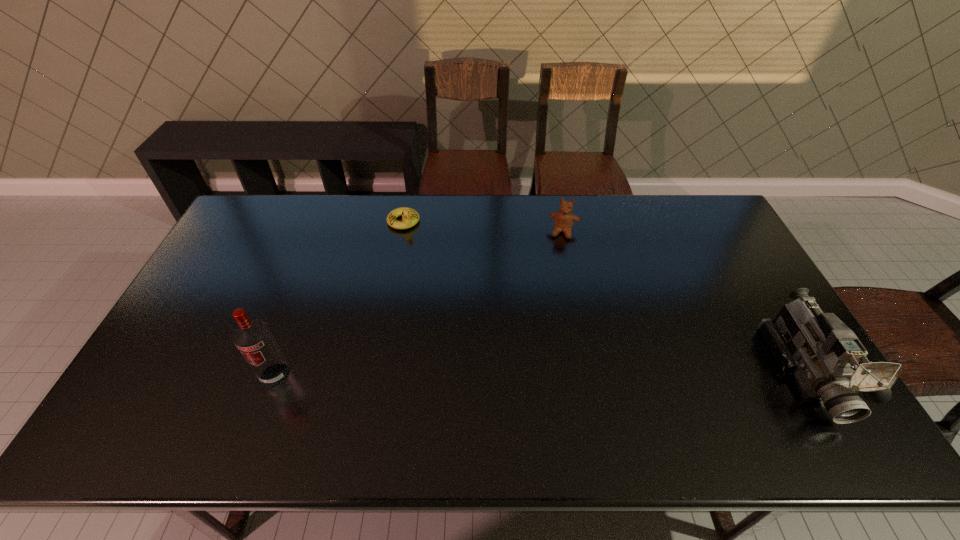
In order to click on vacant space located 0.220m on the face of the second object from left to right in this screenshot , I will do `click(431, 272)`.

This screenshot has height=540, width=960. I want to click on free spot located on the face of the second object from left to right, so click(437, 282).

Identify the location of free point located 0.250m on the face of the second shortest object. The width and height of the screenshot is (960, 540). (553, 293).

At what (x,y) coordinates should I click in order to perform the action: click on vacant space located on the face of the second shortest object. Please return your answer as a coordinate pair (x, y). This screenshot has width=960, height=540. Looking at the image, I should click on (546, 332).

You are a GUI agent. You are given a task and a screenshot of the screen. Output one action in this format:
    pyautogui.click(x=<x>, y=<y>)
    Task: Click on the vacant space located on the face of the second shortest object
    
    Given the screenshot: What is the action you would take?
    pyautogui.click(x=547, y=329)

The height and width of the screenshot is (540, 960). Identify the location of duckling that is at the far edge. (410, 217).

Identify the location of teddy bear present at the far edge. This screenshot has height=540, width=960. (564, 219).

In order to click on vodka located at the near edge in this screenshot , I will do `click(253, 338)`.

Where is `camcorder located at the near edge`? The width and height of the screenshot is (960, 540). camcorder located at the near edge is located at coordinates pos(828,360).

Locate an element on the screen. This screenshot has height=540, width=960. object present at the right edge is located at coordinates (828, 360).